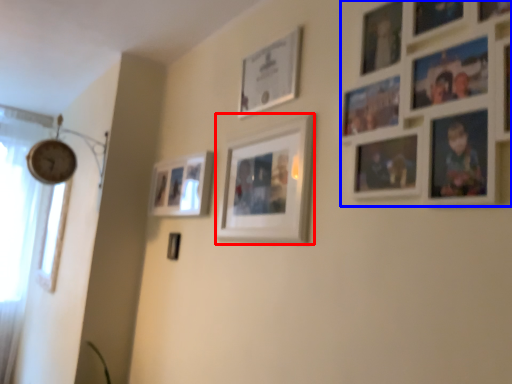
Question: Which object appears farthest to the camera in this image, picture frame (highlighted by a red box) or picture frame (highlighted by a blue box)?

Choices:
 (A) picture frame
 (B) picture frame

Answer: (A)